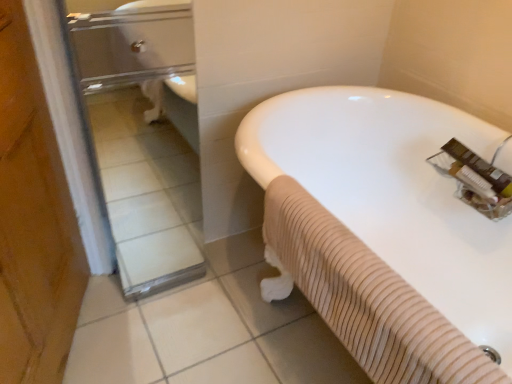
Question: Is point (382, 188) positioned closer to the camera than point (103, 39)?

Choices:
 (A) farther
 (B) closer

Answer: (A)

Question: Choose the correct answer: Is white rubber bathtub at center inside clear glass door at left or outside it?

Choices:
 (A) outside
 (B) inside

Answer: (A)

Question: Considering the positions of white rubber bathtub at center and clear glass door at left in the image, is white rubber bathtub at center bigger or smaller than clear glass door at left?

Choices:
 (A) small
 (B) big

Answer: (B)

Question: Considering the positions of clear glass door at left and white rubber bathtub at center in the image, is clear glass door at left wider or thinner than white rubber bathtub at center?

Choices:
 (A) wide
 (B) thin

Answer: (B)

Question: Considering their positions, is clear glass door at left located in front of or behind white rubber bathtub at center?

Choices:
 (A) behind
 (B) front

Answer: (A)

Question: From a real-world perspective, relative to white rubber bathtub at center, is clear glass door at left vertically above or below?

Choices:
 (A) above
 (B) below

Answer: (A)

Question: Considering the positions of point (159, 107) and point (292, 110), is point (159, 107) closer or farther from the camera than point (292, 110)?

Choices:
 (A) farther
 (B) closer

Answer: (A)